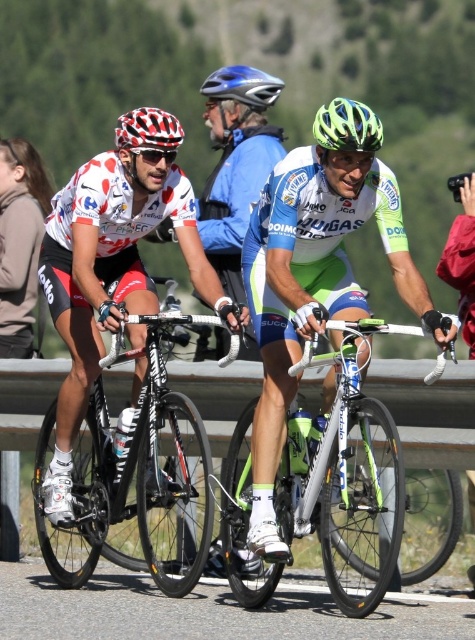
Does matte white helmet at center come in front of white/green metallic bicycle at center?

That is False.

Looking at this image, is matte white helmet at center behind white/green metallic bicycle at center?

Yes.

Does point (102, 340) lie behind point (248, 474)?

Yes, point (102, 340) is farther from viewer.

At what (x,y) coordinates should I click in order to perform the action: click on matte white helmet at center. Please return your answer as a coordinate pair (x, y). The image size is (475, 640). Looking at the image, I should click on (110, 276).

In the scene shown: Does matte white helmet at center have a greater height compared to checkered fabric helmet at left?

No, matte white helmet at center is not taller than checkered fabric helmet at left.

Who is more distant from viewer, (57, 422) or (157, 113)?

Positioned behind is point (57, 422).

Where is `matte white helmet at center`? The image size is (475, 640). matte white helmet at center is located at coordinates (110, 276).

Consider the image. Does white/green metallic bicycle at center appear under shiny black frame at left?

Actually, white/green metallic bicycle at center is above shiny black frame at left.

Which is above, white/green metallic bicycle at center or shiny black frame at left?

white/green metallic bicycle at center is above.

What do you see at coordinates (326, 486) in the screenshot? Image resolution: width=475 pixels, height=640 pixels. I see `white/green metallic bicycle at center` at bounding box center [326, 486].

In order to click on white/green metallic bicycle at center in this screenshot , I will do `click(326, 486)`.